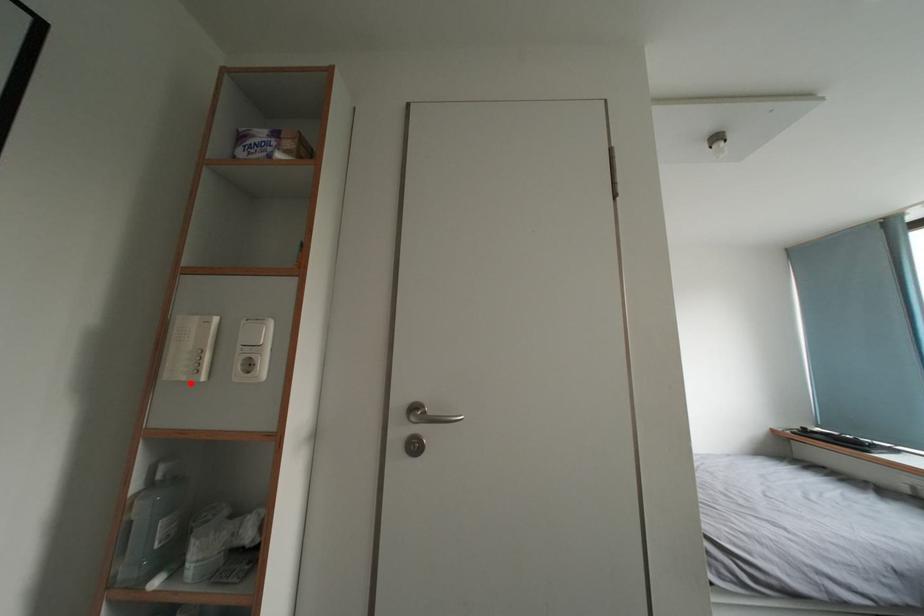
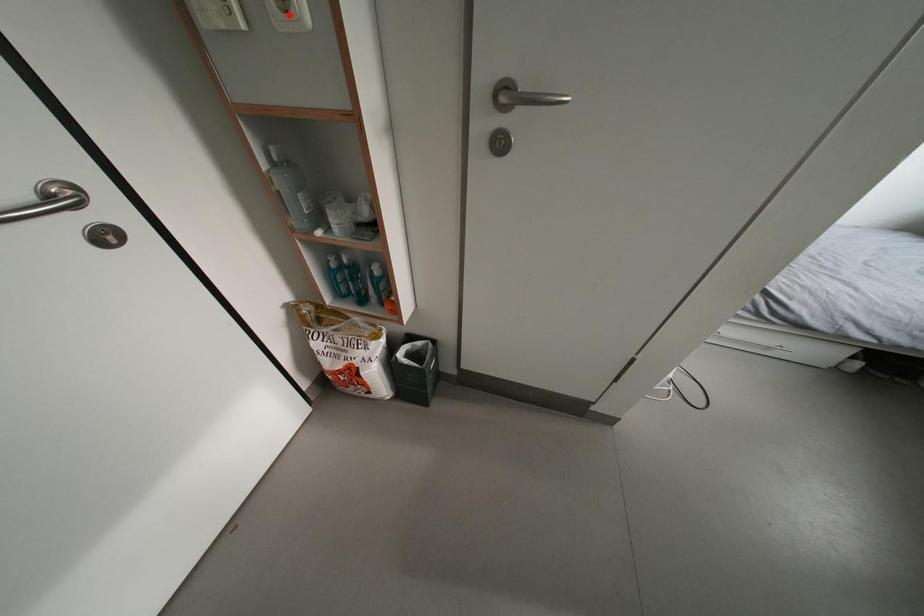
I am providing you with two images of the same scene from different viewpoints. A red point is marked on the first image and another point is marked on the second image. Does the point marked in image1 correspond to the same location as the one in image2?

No